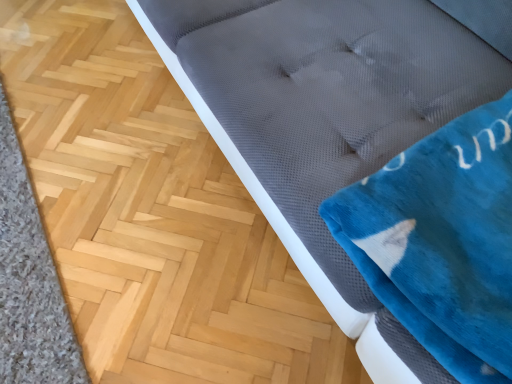
This screenshot has width=512, height=384. Describe the element at coordinates (29, 281) in the screenshot. I see `gray carpet at lower left` at that location.

This screenshot has width=512, height=384. In order to click on gray carpet at lower left in this screenshot , I will do `click(29, 281)`.

Locate an element on the screen. Image resolution: width=512 pixels, height=384 pixels. velvety blue blanket at upper right is located at coordinates 442,241.

What do you see at coordinates (442, 241) in the screenshot? The height and width of the screenshot is (384, 512). I see `velvety blue blanket at upper right` at bounding box center [442, 241].

In order to face velvety blue blanket at upper right, should I rotate leftwards or rightwards?

To face it directly, rotate right by 31.480 degrees.

Measure the distance between velvety blue blanket at upper right and camera.

velvety blue blanket at upper right and camera are 24.25 inches apart from each other.

You are a GUI agent. You are given a task and a screenshot of the screen. Output one action in this format:
    pyautogui.click(x=<x>, y=<y>)
    Task: Click on the gray carpet at lower left
    
    Given the screenshot: What is the action you would take?
    pyautogui.click(x=29, y=281)

From the picture: Which object is positioned more to the right, velvety blue blanket at upper right or gray carpet at lower left?

velvety blue blanket at upper right.

Considering the positions of objects velvety blue blanket at upper right and gray carpet at lower left in the image provided, who is in front, velvety blue blanket at upper right or gray carpet at lower left?

velvety blue blanket at upper right is in front.

Does point (360, 256) lie behind point (40, 279)?

No, (360, 256) is in front of (40, 279).

From the image's perspective, which one is positioned higher, velvety blue blanket at upper right or gray carpet at lower left?

velvety blue blanket at upper right, from the image's perspective.

From a real-world perspective, who is located lower, velvety blue blanket at upper right or gray carpet at lower left?

gray carpet at lower left, from a real-world perspective.

Looking at this image, considering the sizes of objects velvety blue blanket at upper right and gray carpet at lower left in the image provided, who is wider, velvety blue blanket at upper right or gray carpet at lower left?

Wider between the two is velvety blue blanket at upper right.

Considering the sizes of objects velvety blue blanket at upper right and gray carpet at lower left in the image provided, who is shorter, velvety blue blanket at upper right or gray carpet at lower left?

Standing shorter between the two is gray carpet at lower left.

Considering the relative sizes of velvety blue blanket at upper right and gray carpet at lower left in the image provided, is velvety blue blanket at upper right smaller than gray carpet at lower left?

Actually, velvety blue blanket at upper right might be larger than gray carpet at lower left.

Is velvety blue blanket at upper right completely or partially outside of gray carpet at lower left?

velvety blue blanket at upper right lies outside gray carpet at lower left's area.

Is velvety blue blanket at upper right not close to gray carpet at lower left?

They are positioned close to each other.

Does velvety blue blanket at upper right turn towards gray carpet at lower left?

No, velvety blue blanket at upper right is not oriented towards gray carpet at lower left.

Can you tell me how much velvety blue blanket at upper right and gray carpet at lower left differ in facing direction?

178 degrees.

Measure the distance between velvety blue blanket at upper right and gray carpet at lower left.

38.43 inches.

This screenshot has height=384, width=512. I want to click on cloth that is in front of the gray carpet at lower left, so click(x=442, y=241).

Is gray carpet at lower left to the left or to the right of velvety blue blanket at upper right in the image?

gray carpet at lower left is positioned on velvety blue blanket at upper right's left side.

Is gray carpet at lower left further to camera compared to velvety blue blanket at upper right?

Yes.

Does point (34, 211) appear closer or farther from the camera than point (423, 298)?

Point (34, 211).

From the image's perspective, is gray carpet at lower left above or below velvety blue blanket at upper right?

gray carpet at lower left is situated lower than velvety blue blanket at upper right in the image.

Consider the image. From a real-world perspective, which object stands above the other?

In real-world perspective, velvety blue blanket at upper right is above.

Considering the relative sizes of gray carpet at lower left and velvety blue blanket at upper right in the image provided, is gray carpet at lower left wider than velvety blue blanket at upper right?

In fact, gray carpet at lower left might be narrower than velvety blue blanket at upper right.

Which of these two, gray carpet at lower left or velvety blue blanket at upper right, stands taller?

velvety blue blanket at upper right.

Which of these two, gray carpet at lower left or velvety blue blanket at upper right, is smaller?

With smaller size is gray carpet at lower left.

Is gray carpet at lower left spatially inside velvety blue blanket at upper right, or outside of it?

gray carpet at lower left is not inside velvety blue blanket at upper right, it's outside.

Is gray carpet at lower left not close to velvety blue blanket at upper right?

gray carpet at lower left is actually quite close to velvety blue blanket at upper right.

Is gray carpet at lower left facing towards velvety blue blanket at upper right?

No, gray carpet at lower left is not aimed at velvety blue blanket at upper right.

Measure the distance between gray carpet at lower left and velvety blue blanket at upper right.

gray carpet at lower left is 38.43 inches from velvety blue blanket at upper right.

Find the location of a particular element. The image size is (512, 384). cloth above the gray carpet at lower left (from the image's perspective) is located at coordinates (442, 241).

Find the location of a particular element. doormat on the left of velvety blue blanket at upper right is located at coordinates (29, 281).

Image resolution: width=512 pixels, height=384 pixels. What are the coordinates of `cloth above the gray carpet at lower left (from a real-world perspective)` in the screenshot? It's located at (442, 241).